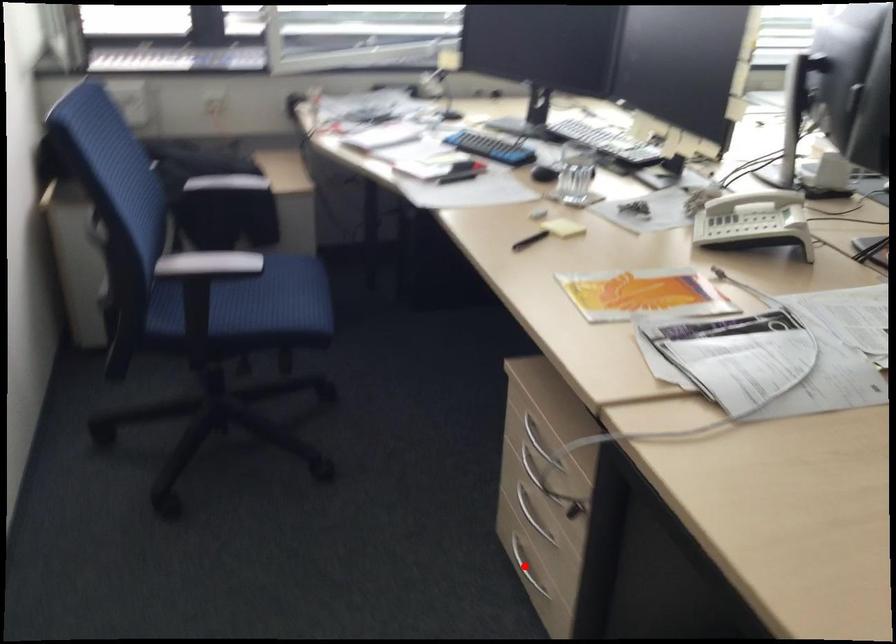
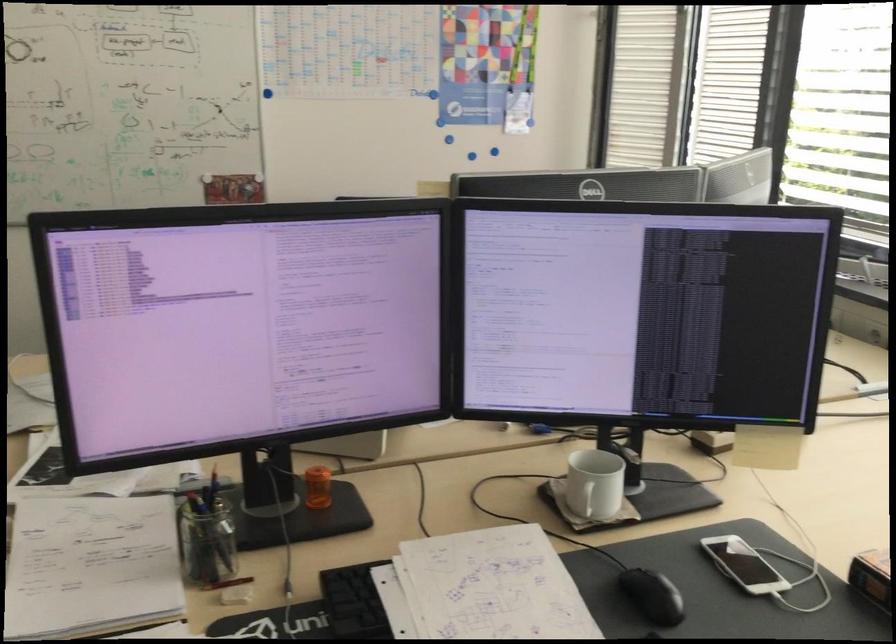
Question: I am providing you with two images of the same scene from different viewpoints. A red point is marked on the first image. Is the red point's position out of view in image 2?

Choices:
 (A) Yes
 (B) No

Answer: (A)